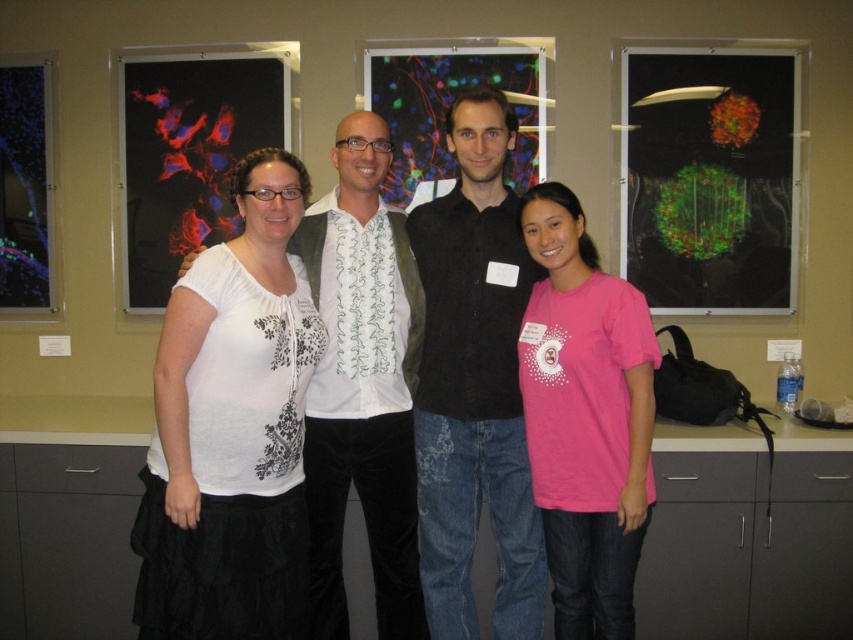
You are organizing a clothing donation drive and need to categorize shirts by size. Looking at the image, which shirt between the black matte shirt at center and the white printed shirt at center would you place in the small size bin?

The black matte shirt at center is smaller than the white printed shirt at center, so it should be placed in the small size bin.

You are a photographer setting up for a group photo. You need to ensure that the black matte shirt at center and the white printed shirt at center are at least 8 inches apart for proper framing. Based on the current arrangement, is this requirement met?

The black matte shirt at center and white printed shirt at center are 6.85 inches apart from each other, which is less than the required 8 inches. Therefore, the requirement is not met and they need to adjust their positions to increase the distance between them.

From the picture: You are a photographer adjusting the camera focus. The camera can only focus on objects within a 20 inch range. Are the white lace blouse at center and the black matte shirt at center within the focus range?

The white lace blouse at center is 20.52 inches away from the black matte shirt at center. Since the distance between them is slightly over 20 inches, the camera cannot focus on both simultaneously within the 20 inch range.